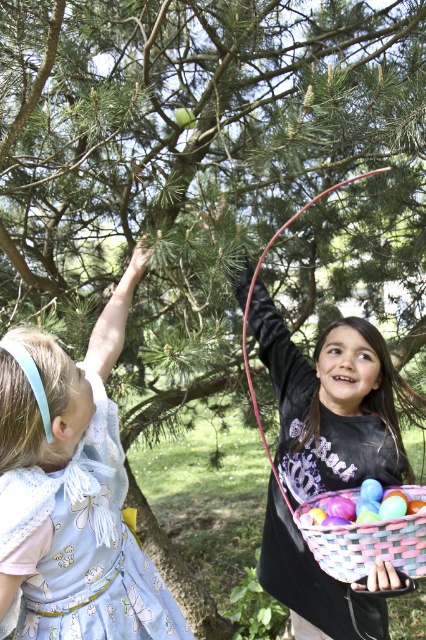
You are a parent supervising the Easter egg hunt and want to ensure the children stay within a safe area. Given that the green pine tree at upper center is at coordinates point 0.270, 0.486, can you determine if the children are positioned to the left or right of the tree based on their clothing descriptions?

The green pine tree at upper center is located at point (207, 172), but without specific coordinates for the children, it is impossible to determine their exact positions relative to the tree based solely on clothing descriptions.

You are a parent trying to ensure the safety of your children during an Easter egg hunt. You notice the green pine tree at upper center and the black matte shirt at upper center. Given that the distance between them is 1.39 meters, can you determine if a 1.5 meter long safety barrier placed between them would completely block any potential falling branches from reaching the child wearing the black matte shirt?

The green pine tree at upper center is 1.39 meters away from the black matte shirt at upper center. A 1.5 meter long safety barrier placed between them would extend beyond the distance between the tree and the shirt, thus completely blocking any potential falling branches from reaching the child wearing the black matte shirt.